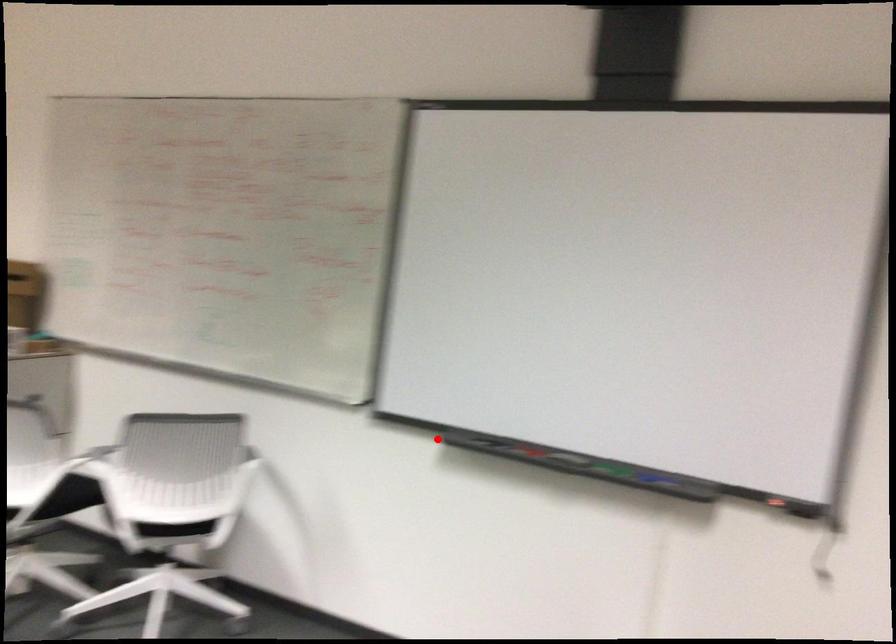
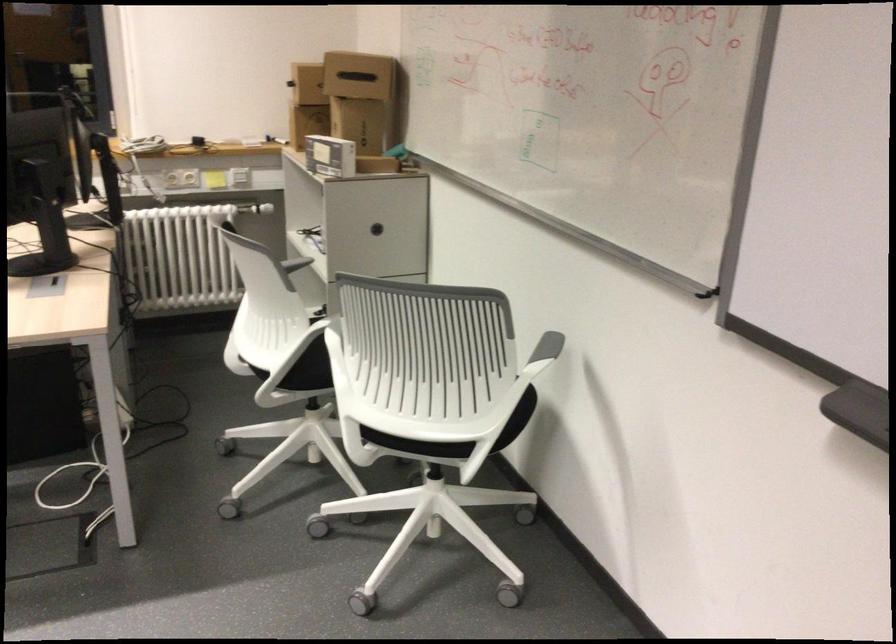
Find the pixel in the second image that matches the highlighted location in the first image.

(858, 411)